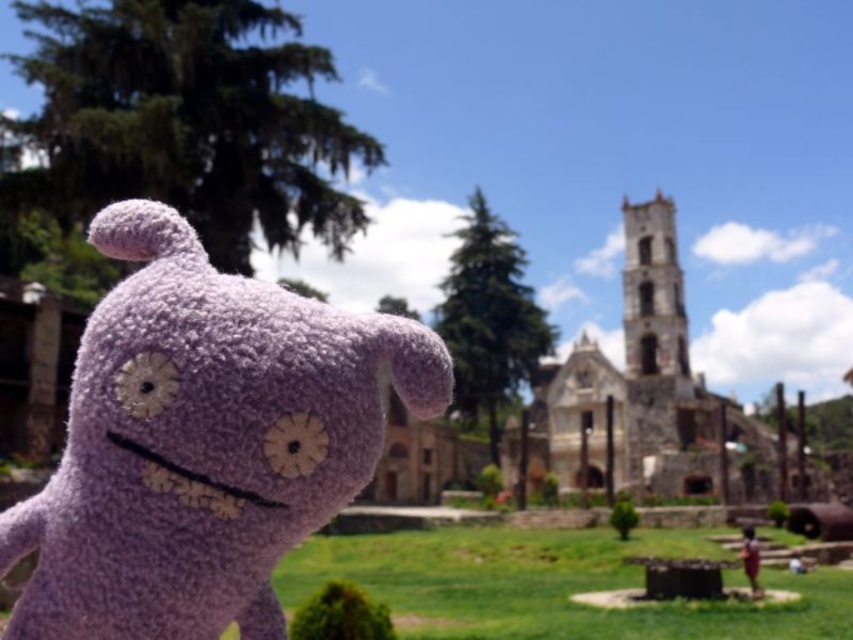
Question: Which of the following is the farthest from the observer?

Choices:
 (A) (189, 330)
 (B) (705, 444)

Answer: (B)

Question: Does purple fuzzy toy at left have a smaller size compared to stone church at center?

Choices:
 (A) no
 (B) yes

Answer: (B)

Question: Which of the following is the farthest from the observer?

Choices:
 (A) (711, 394)
 (B) (260, 576)

Answer: (A)

Question: Does purple fuzzy toy at left have a lesser width compared to stone church at center?

Choices:
 (A) yes
 (B) no

Answer: (A)

Question: Is purple fuzzy toy at left to the right of stone church at center from the viewer's perspective?

Choices:
 (A) no
 (B) yes

Answer: (A)